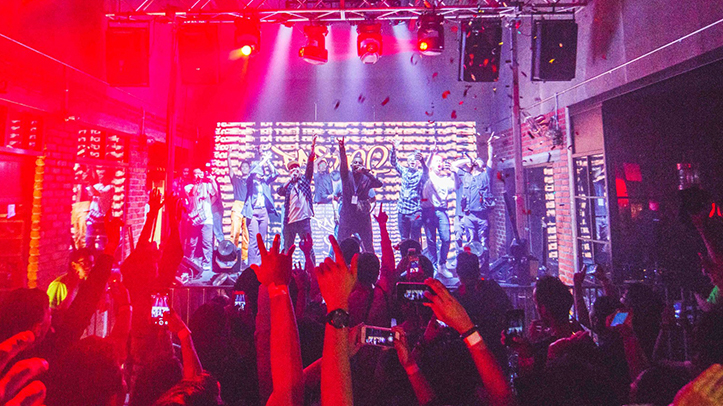
Find the location of `phone`. phone is located at coordinates (377, 331), (239, 299), (155, 305), (406, 290), (406, 271), (513, 325).